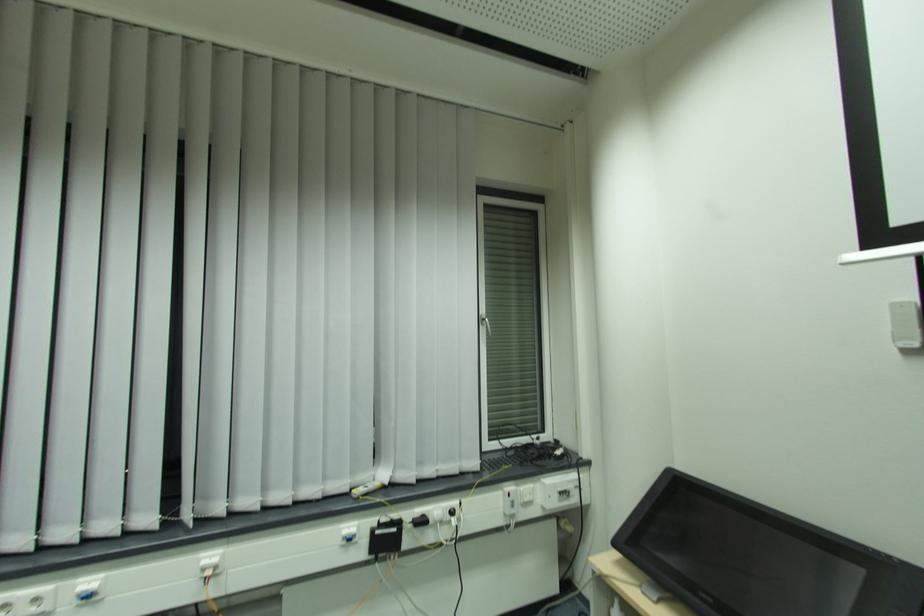
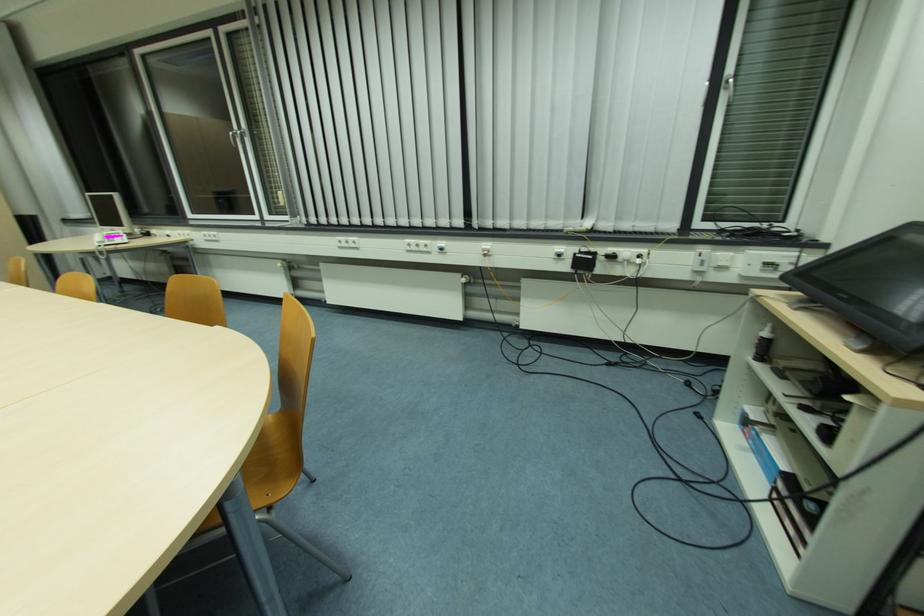
Based on the continuous images, in which direction is the camera rotating?

The rotation direction of the camera is left-down.